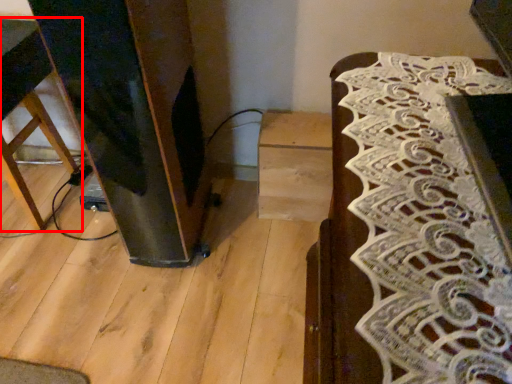
Question: From the image, what is the correct spatial relationship of furniture (annotated by the red box) in relation to furniture?

Choices:
 (A) left
 (B) right

Answer: (A)